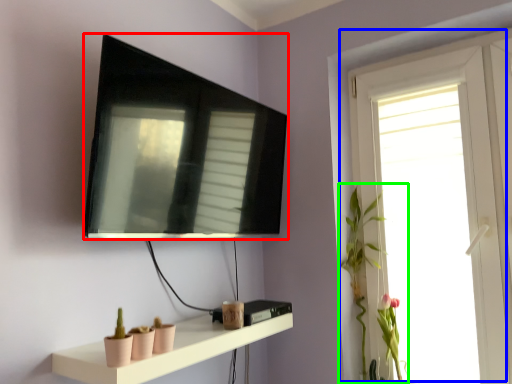
Question: Estimate the real-world distances between objects in this image. Which object is closer to television (highlighted by a red box), window (highlighted by a blue box) or plant (highlighted by a green box)?

Choices:
 (A) window
 (B) plant

Answer: (B)